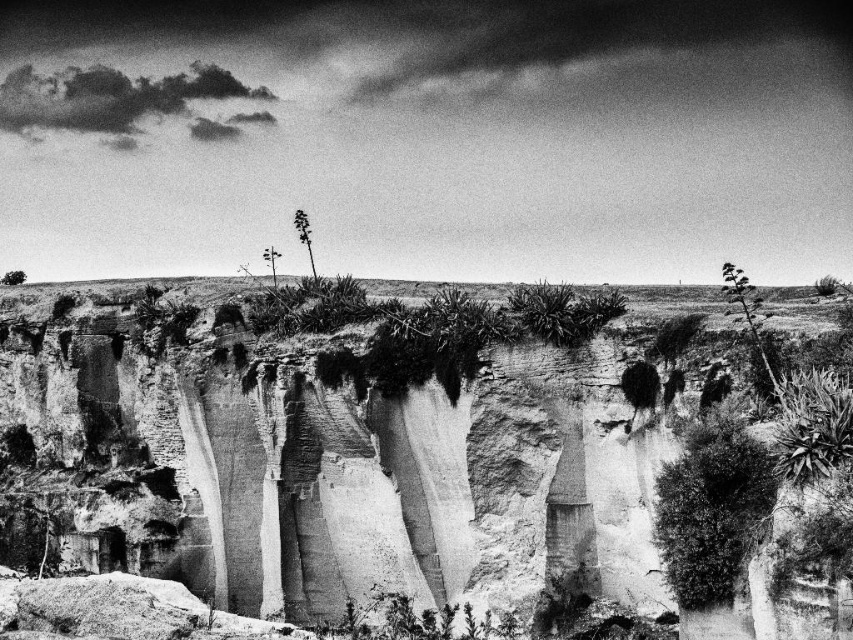
You are a geologist examining the cliffs in the image. You notice a point marked at coordinates (746, 310). Based on the scene description, where is this point located?

The point is located on thick green foliage at upper right.